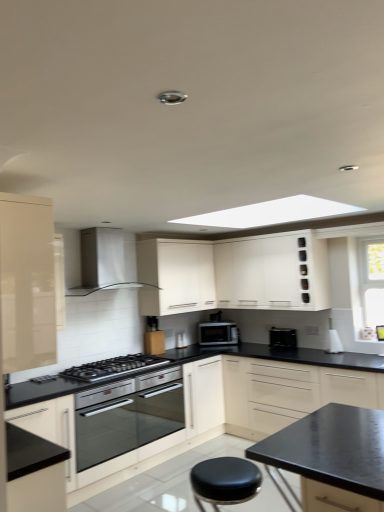
Question: Visually, is black leather stool at lower center positioned to the left or to the right of black matte toaster at lower center?

Choices:
 (A) left
 (B) right

Answer: (A)

Question: Is black leather stool at lower center taller or shorter than black matte toaster at lower center?

Choices:
 (A) short
 (B) tall

Answer: (B)

Question: Which object is the farthest from the white matte cabinet at upper center, arranged as the second cabinetry when viewed from the back?

Choices:
 (A) black glass gas stove at center
 (B) black matte toaster at lower center
 (C) matte cream cabinet at center, acting as the third cabinetry starting from the back
 (D) glossy beige cabinet at left, which is the 4th cabinetry in back-to-front order
 (E) stainless steel oven at center

Answer: (D)

Question: Which of these objects is positioned farthest from the black glass gas stove at center?

Choices:
 (A) white matte cabinet at upper center, which is the 3th cabinetry from front to back
 (B) stainless steel oven at center
 (C) black leather stool at lower center
 (D) glossy beige cabinet at left, which is counted as the first cabinetry, starting from the front
 (E) satin silver microwave at center

Answer: (D)